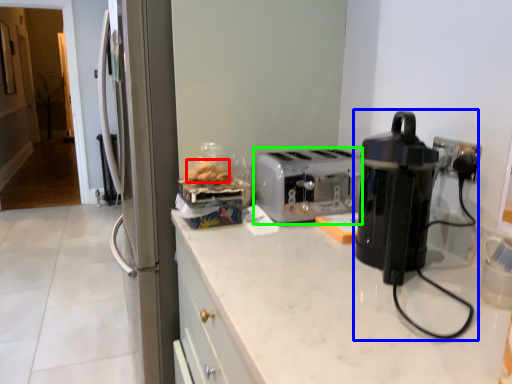
Question: Based on their relative distances, which object is farther from food (highlighted by a red box)? Choose from home appliance (highlighted by a blue box) and toaster (highlighted by a green box).

Choices:
 (A) home appliance
 (B) toaster

Answer: (A)